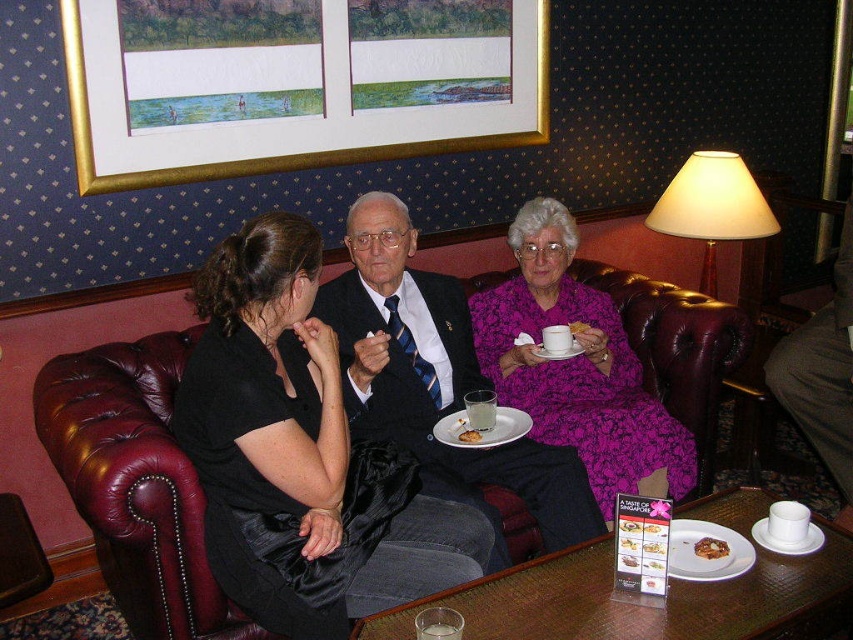
Question: Considering the relative positions of matte black suit at center and purple floral dress at center in the image provided, where is matte black suit at center located with respect to purple floral dress at center?

Choices:
 (A) right
 (B) left

Answer: (B)

Question: Which point appears closest to the camera in this image?

Choices:
 (A) (434, 630)
 (B) (602, 401)
 (C) (585, 324)
 (D) (260, 301)

Answer: (A)

Question: Which point is closer to the camera?

Choices:
 (A) wooden textured table at lower center
 (B) purple floral dress at center
 (C) gold-framed picture at upper center
 (D) smooth cream cupcake at upper center

Answer: (A)

Question: Which point appears closest to the camera in this image?

Choices:
 (A) (384, 428)
 (B) (750, 522)
 (C) (724, 544)

Answer: (C)

Question: Can you confirm if gold-framed picture at upper center is wider than wooden textured table at lower center?

Choices:
 (A) no
 (B) yes

Answer: (B)

Question: Is smooth brown sauce at center further to the viewer compared to smooth cream cupcake at upper center?

Choices:
 (A) no
 (B) yes

Answer: (A)